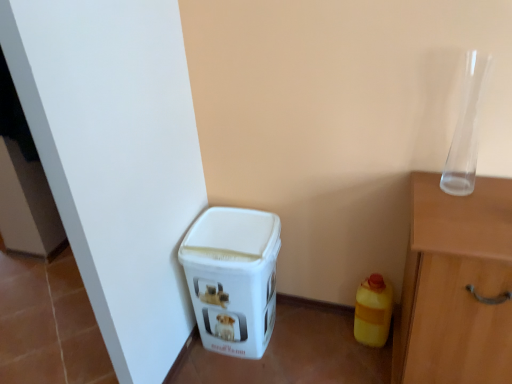
Question: Considering the relative positions of yellow matte plastic bottle at lower right and transparent glass vase at upper right in the image provided, is yellow matte plastic bottle at lower right to the right of transparent glass vase at upper right from the viewer's perspective?

Choices:
 (A) no
 (B) yes

Answer: (A)

Question: From the image's perspective, is yellow matte plastic bottle at lower right on top of transparent glass vase at upper right?

Choices:
 (A) no
 (B) yes

Answer: (A)

Question: Is yellow matte plastic bottle at lower right bigger than transparent glass vase at upper right?

Choices:
 (A) no
 (B) yes

Answer: (B)

Question: Can you confirm if yellow matte plastic bottle at lower right is smaller than transparent glass vase at upper right?

Choices:
 (A) no
 (B) yes

Answer: (A)

Question: Is yellow matte plastic bottle at lower right wider than transparent glass vase at upper right?

Choices:
 (A) no
 (B) yes

Answer: (B)

Question: Is white plastic bin at lower left inside the boundaries of transparent glass vase at upper right, or outside?

Choices:
 (A) outside
 (B) inside

Answer: (A)

Question: Considering their positions, is white plastic bin at lower left located in front of or behind transparent glass vase at upper right?

Choices:
 (A) behind
 (B) front

Answer: (A)

Question: From the image's perspective, is white plastic bin at lower left above or below transparent glass vase at upper right?

Choices:
 (A) below
 (B) above

Answer: (A)

Question: From their relative heights in the image, would you say white plastic bin at lower left is taller or shorter than transparent glass vase at upper right?

Choices:
 (A) tall
 (B) short

Answer: (A)

Question: Looking at the image, does yellow matte plastic bottle at lower right seem bigger or smaller compared to white plastic bin at lower left?

Choices:
 (A) big
 (B) small

Answer: (B)

Question: Is yellow matte plastic bottle at lower right to the left or to the right of white plastic bin at lower left in the image?

Choices:
 (A) right
 (B) left

Answer: (A)

Question: From the image's perspective, is yellow matte plastic bottle at lower right above or below white plastic bin at lower left?

Choices:
 (A) above
 (B) below

Answer: (B)

Question: From a real-world perspective, is yellow matte plastic bottle at lower right positioned above or below white plastic bin at lower left?

Choices:
 (A) below
 (B) above

Answer: (A)

Question: Does point (x=474, y=84) appear closer or farther from the camera than point (x=375, y=319)?

Choices:
 (A) farther
 (B) closer

Answer: (B)

Question: From the image's perspective, is transparent glass vase at upper right above or below yellow matte plastic bottle at lower right?

Choices:
 (A) below
 (B) above

Answer: (B)